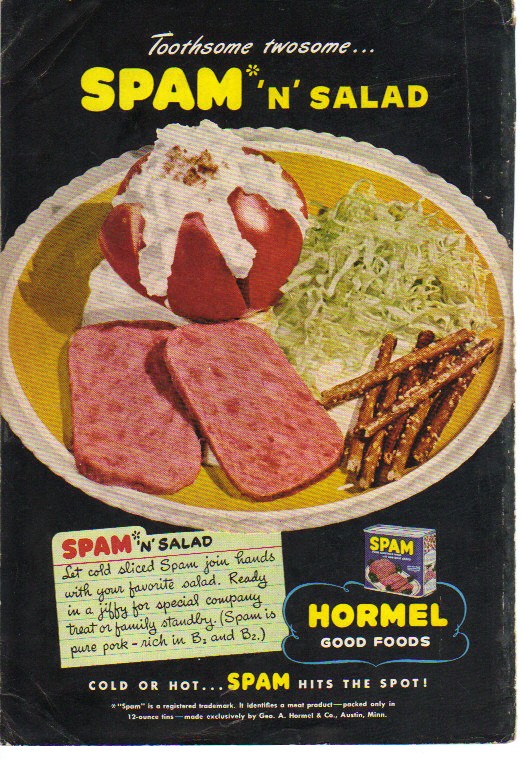
Image resolution: width=521 pixels, height=759 pixels. Identify the location of dish inside. (326, 181).